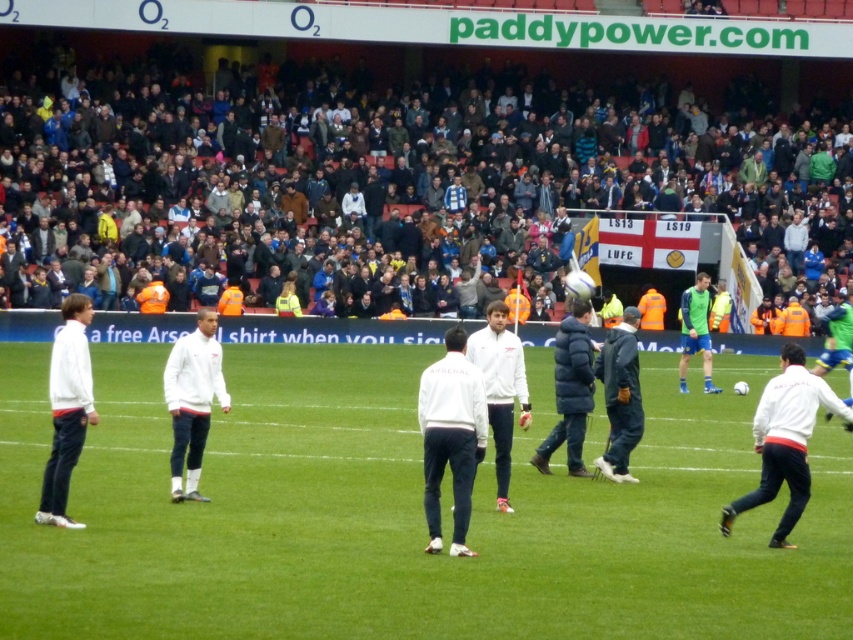
Which is in front, point (692, 173) or point (798, 417)?

Positioned in front is point (798, 417).

Which is above, dark gray crowd at upper center or white matte jacket at lower right?

dark gray crowd at upper center

This screenshot has width=853, height=640. I want to click on dark gray crowd at upper center, so [372, 168].

Which of these two, green grass field at center or dark gray crowd at upper center, stands shorter?

green grass field at center is shorter.

Is point (73, 577) more distant than point (38, 168)?

No, (73, 577) is in front of (38, 168).

Locate an element on the screen. The height and width of the screenshot is (640, 853). green grass field at center is located at coordinates (404, 513).

Is point (717, 476) less distant than point (805, 392)?

No, (717, 476) is further to viewer.

Based on the photo, does green grass field at center have a lesser height compared to white matte jacket at lower right?

Correct, green grass field at center is not as tall as white matte jacket at lower right.

Which is behind, point (660, 452) or point (775, 492)?

The point (660, 452) is more distant.

Locate an element on the screen. This screenshot has width=853, height=640. green grass field at center is located at coordinates (404, 513).